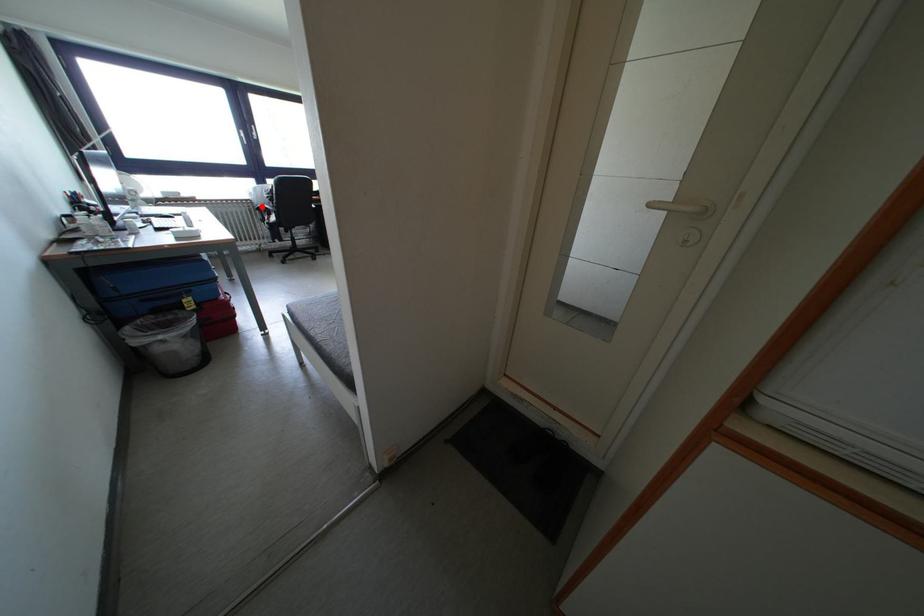
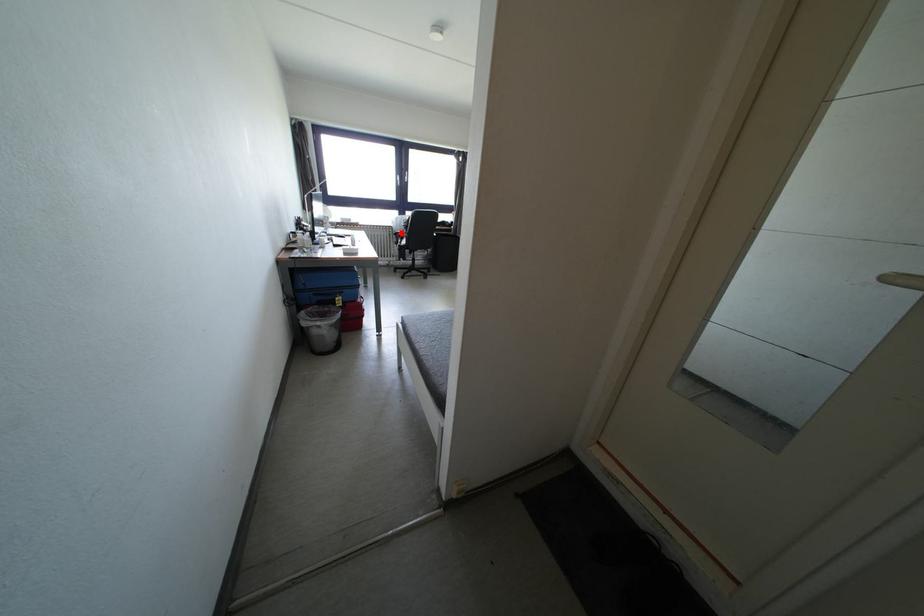
Consider the image. I am providing you with two images of the same scene from different viewpoints. A red point is marked on the first image and another point is marked on the second image. Is the red point in image1 aligned with the point shown in image2?

Yes